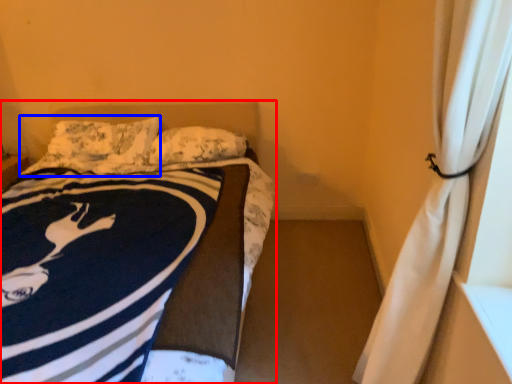
Question: Which object appears farthest to the camera in this image, bed (highlighted by a red box) or pillow (highlighted by a blue box)?

Choices:
 (A) bed
 (B) pillow

Answer: (B)